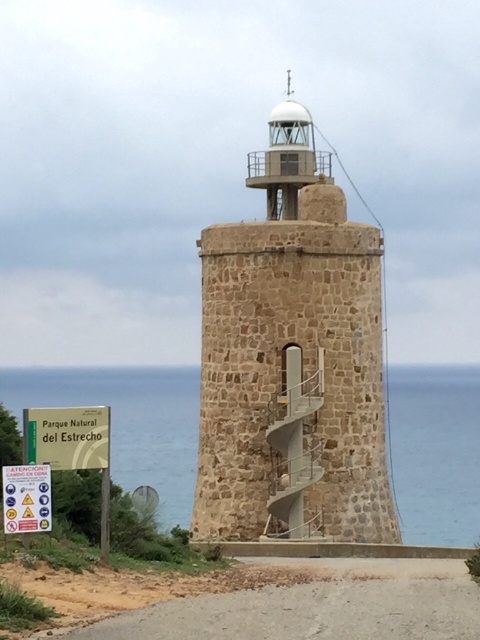
Question: Can you confirm if brown stone tower at center is wider than brown gravel road at lower center?

Choices:
 (A) no
 (B) yes

Answer: (A)

Question: Does green plastic sign at lower left appear over yellow paper sign at lower left?

Choices:
 (A) no
 (B) yes

Answer: (B)

Question: Which object is closer to the camera taking this photo?

Choices:
 (A) satin silver staircase at center
 (B) green plastic sign at lower left
 (C) yellow paper sign at lower left
 (D) brown gravel road at lower center

Answer: (D)

Question: Among these objects, which one is farthest from the camera?

Choices:
 (A) brown gravel road at lower center
 (B) brown stone tower at center
 (C) blue water at lower center
 (D) yellow paper sign at lower left

Answer: (C)

Question: Observing the image, what is the correct spatial positioning of satin silver staircase at center in reference to green plastic sign at lower left?

Choices:
 (A) left
 (B) right

Answer: (B)

Question: Which of these objects is positioned farthest from the yellow paper sign at lower left?

Choices:
 (A) brown stone tower at center
 (B) satin silver staircase at center

Answer: (A)